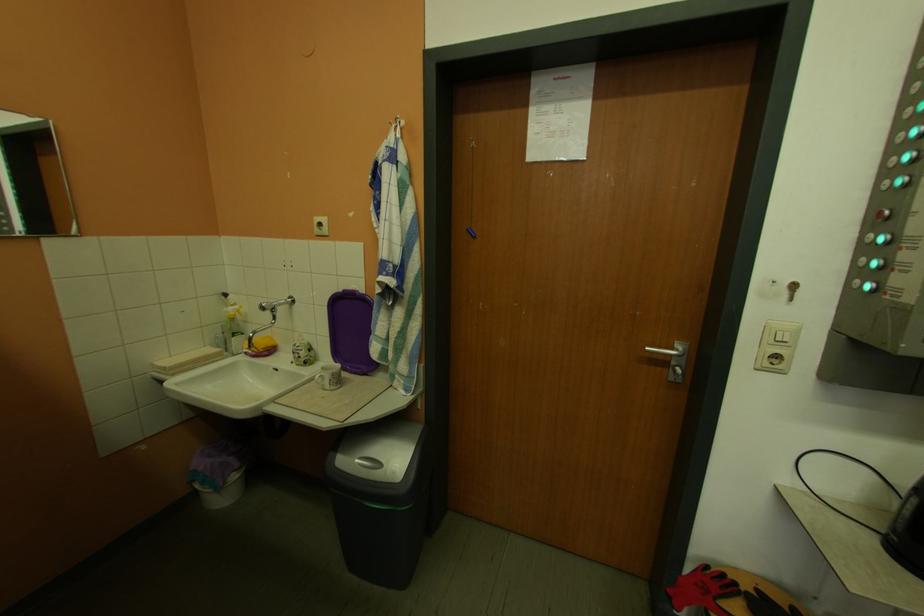
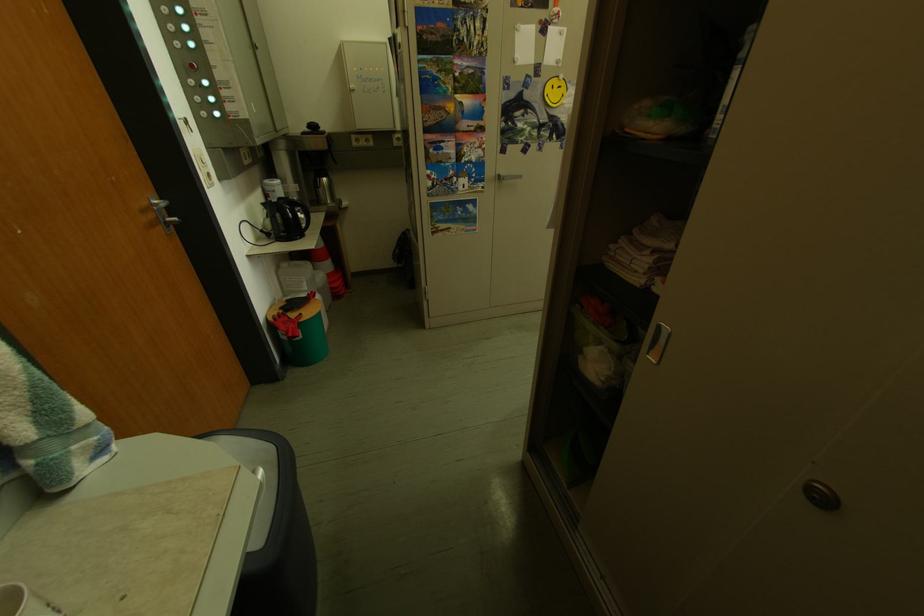
Find the pixel in the second image that matches pixel 694 353 in the first image.

(168, 205)